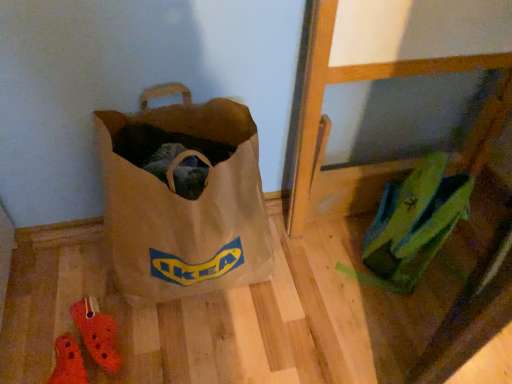
Where is `vacant space in between green fabric backpack at upper right and rubber crocs at lower left, which is counted as the 1th footwear, starting from the bottom`? This screenshot has width=512, height=384. vacant space in between green fabric backpack at upper right and rubber crocs at lower left, which is counted as the 1th footwear, starting from the bottom is located at coordinates (282, 307).